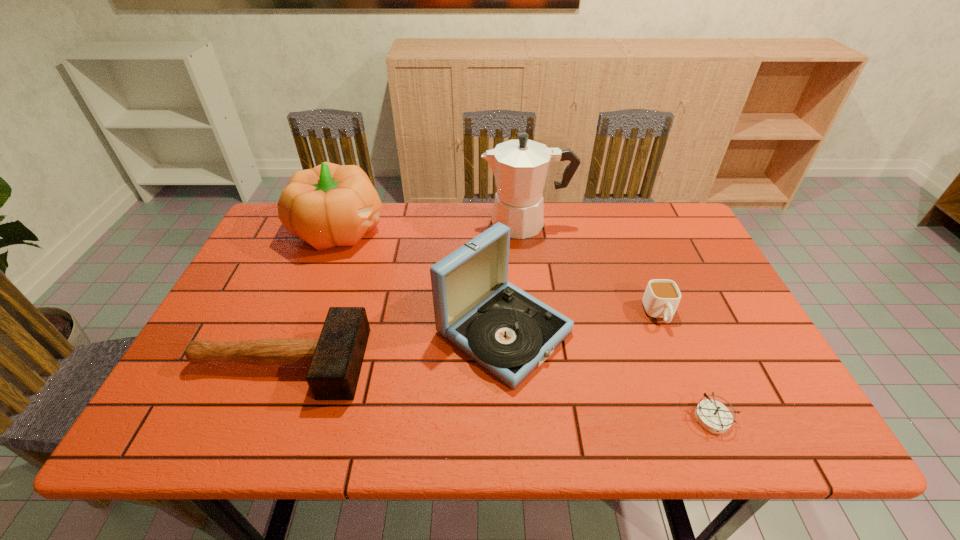
You are a GUI agent. You are given a task and a screenshot of the screen. Output one action in this format:
    pyautogui.click(x=<x>, y=<y>)
    Task: Click on the unoccupied area between the shortest object and the mallet
    The image size is (960, 540).
    Given the screenshot: What is the action you would take?
    pyautogui.click(x=496, y=390)

Identify the location of vacant point located between the mallet and the phonograph record. This screenshot has width=960, height=540. (392, 347).

The height and width of the screenshot is (540, 960). Identify the location of blank region between the phonograph record and the pumpkin. (422, 281).

Find the location of a particular element. The height and width of the screenshot is (540, 960). the fourth closest object to the cup is located at coordinates (335, 359).

Find the location of `object that is the fifth nearest to the coffeepot`. object that is the fifth nearest to the coffeepot is located at coordinates (713, 416).

The image size is (960, 540). In order to click on blank space that satisfies the following two spatial constraints: 1. on the back side of the shortest object; 2. on the hammer head face of the mallet in this screenshot , I will do `click(690, 363)`.

At what (x,y) coordinates should I click in order to perform the action: click on free spot that satisfies the following two spatial constraints: 1. on the side with the handle of the cup; 2. on the hammer head face of the mallet. Please return your answer as a coordinate pair (x, y). Looking at the image, I should click on (679, 363).

I want to click on vacant space that satisfies the following two spatial constraints: 1. on the carved face of the shortest object; 2. on the right side of the pumpkin, so click(x=268, y=418).

Identify the location of vacant area in the image that satisfies the following two spatial constraints: 1. on the back side of the phonograph record; 2. on the carved face of the pumpkin. (499, 230).

You are a GUI agent. You are given a task and a screenshot of the screen. Output one action in this format:
    pyautogui.click(x=<x>, y=<y>)
    Task: Click on the vacant position in the image that satisfies the following two spatial constraints: 1. at the spout of the coffeepot; 2. on the left side of the shortest object
    The height and width of the screenshot is (540, 960).
    Given the screenshot: What is the action you would take?
    pyautogui.click(x=550, y=418)